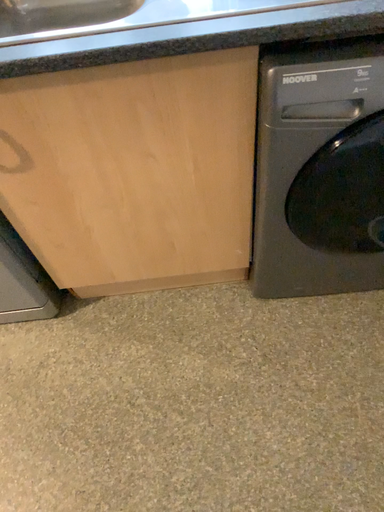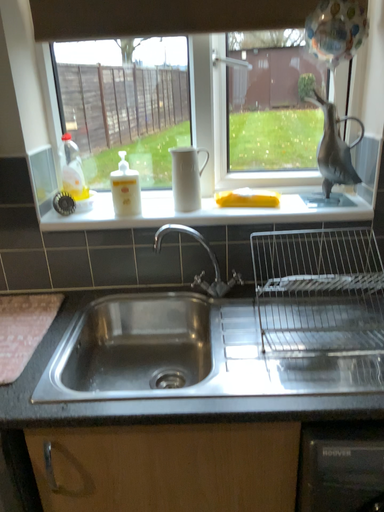
Question: Which way did the camera rotate in the video?

Choices:
 (A) rotated upward
 (B) rotated downward

Answer: (A)